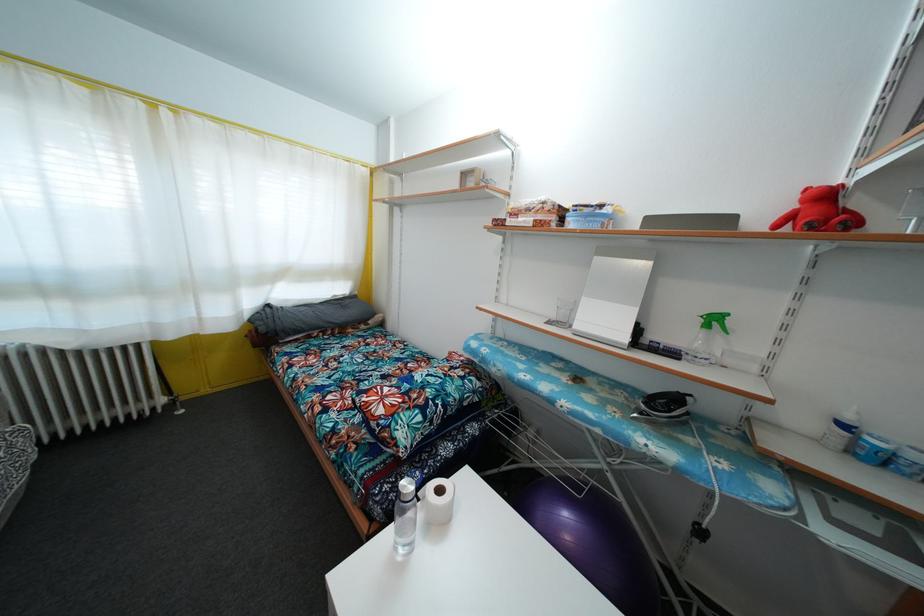
This screenshot has width=924, height=616. I want to click on grey pillow, so click(x=310, y=315).